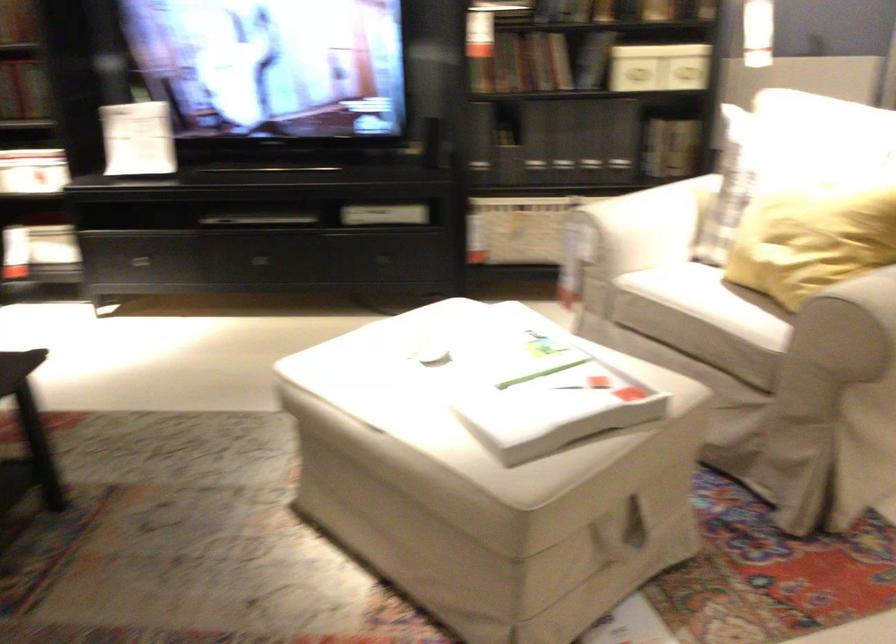
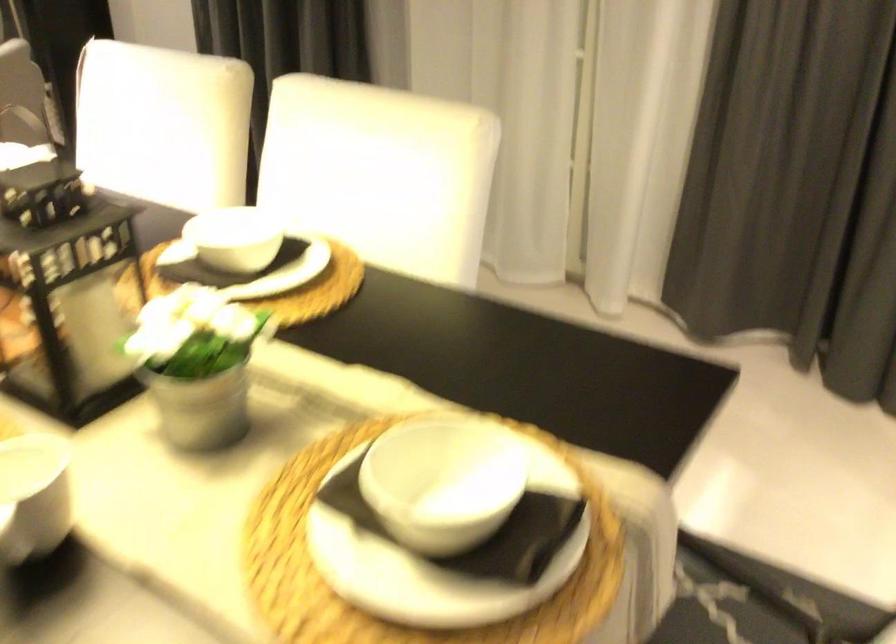
Question: The images are taken continuously from a first-person perspective. In which direction are you moving?

Choices:
 (A) Left
 (B) Right
 (C) Forward
 (D) Backward

Answer: (B)